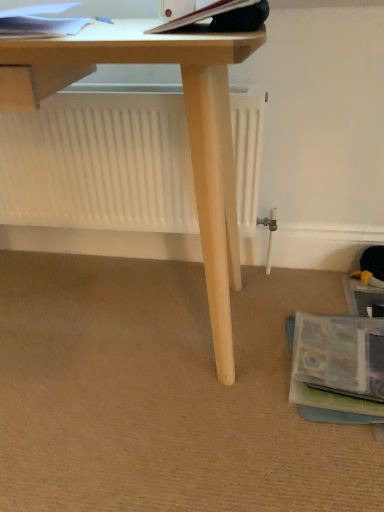
Question: Can you confirm if hardcover book at upper center, marked as the 1th paperback book in a right-to-left arrangement, is smaller than matte paper at upper left, marked as the 1th paperback book in a left-to-right arrangement?

Choices:
 (A) yes
 (B) no

Answer: (A)

Question: Is hardcover book at upper center, marked as the 1th paperback book in a right-to-left arrangement, surrounding matte paper at upper left, placed as the second paperback book when sorted from right to left?

Choices:
 (A) no
 (B) yes

Answer: (A)

Question: Is hardcover book at upper center, the second paperback book when ordered from left to right, positioned far away from matte paper at upper left, marked as the 1th paperback book in a left-to-right arrangement?

Choices:
 (A) no
 (B) yes

Answer: (A)

Question: Is hardcover book at upper center, marked as the 1th paperback book in a right-to-left arrangement, oriented away from matte paper at upper left, placed as the second paperback book when sorted from right to left?

Choices:
 (A) no
 (B) yes

Answer: (A)

Question: Is hardcover book at upper center, marked as the 1th paperback book in a right-to-left arrangement, at the right side of matte paper at upper left, placed as the second paperback book when sorted from right to left?

Choices:
 (A) no
 (B) yes

Answer: (B)

Question: From the image's perspective, does hardcover book at upper center, the second paperback book when ordered from left to right, appear lower than matte paper at upper left, placed as the second paperback book when sorted from right to left?

Choices:
 (A) no
 (B) yes

Answer: (B)

Question: Considering the relative sizes of matte paper at upper left, marked as the 1th paperback book in a left-to-right arrangement, and hardcover book at upper center, the second paperback book when ordered from left to right, in the image provided, is matte paper at upper left, marked as the 1th paperback book in a left-to-right arrangement, shorter than hardcover book at upper center, the second paperback book when ordered from left to right,?

Choices:
 (A) yes
 (B) no

Answer: (A)

Question: Considering the relative positions of matte paper at upper left, placed as the second paperback book when sorted from right to left, and hardcover book at upper center, the second paperback book when ordered from left to right, in the image provided, is matte paper at upper left, placed as the second paperback book when sorted from right to left, to the left of hardcover book at upper center, the second paperback book when ordered from left to right, from the viewer's perspective?

Choices:
 (A) no
 (B) yes

Answer: (B)

Question: Is matte paper at upper left, marked as the 1th paperback book in a left-to-right arrangement, positioned with its back to hardcover book at upper center, the second paperback book when ordered from left to right?

Choices:
 (A) no
 (B) yes

Answer: (A)

Question: Does matte paper at upper left, marked as the 1th paperback book in a left-to-right arrangement, turn towards hardcover book at upper center, the second paperback book when ordered from left to right?

Choices:
 (A) yes
 (B) no

Answer: (B)

Question: Does matte paper at upper left, marked as the 1th paperback book in a left-to-right arrangement, have a larger size compared to hardcover book at upper center, the second paperback book when ordered from left to right?

Choices:
 (A) yes
 (B) no

Answer: (A)

Question: Is matte paper at upper left, placed as the second paperback book when sorted from right to left, outside hardcover book at upper center, marked as the 1th paperback book in a right-to-left arrangement?

Choices:
 (A) no
 (B) yes

Answer: (B)

Question: Is hardcover book at upper center, the second paperback book when ordered from left to right, wider or thinner than matte paper at upper left, placed as the second paperback book when sorted from right to left?

Choices:
 (A) wide
 (B) thin

Answer: (B)